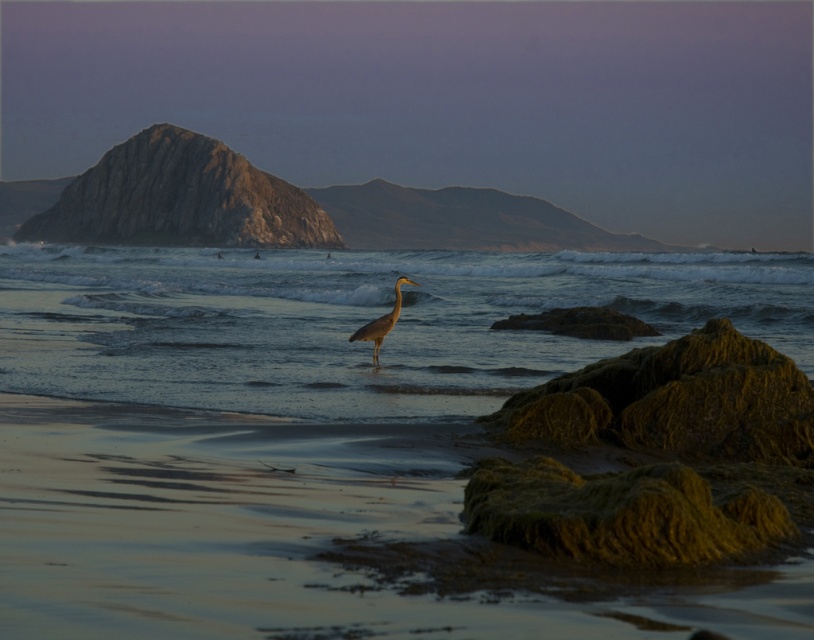
Question: Can you confirm if sandy water at center is wider than gray matte heron at center?

Choices:
 (A) yes
 (B) no

Answer: (A)

Question: Is sandy water at center closer to the viewer compared to gray matte heron at center?

Choices:
 (A) no
 (B) yes

Answer: (B)

Question: Does sandy water at center appear on the left side of gray matte heron at center?

Choices:
 (A) yes
 (B) no

Answer: (A)

Question: Which object appears farthest from the camera in this image?

Choices:
 (A) gray matte heron at center
 (B) sandy water at center

Answer: (A)

Question: Which object appears farthest from the camera in this image?

Choices:
 (A) gray matte heron at center
 (B) sandy water at center

Answer: (A)